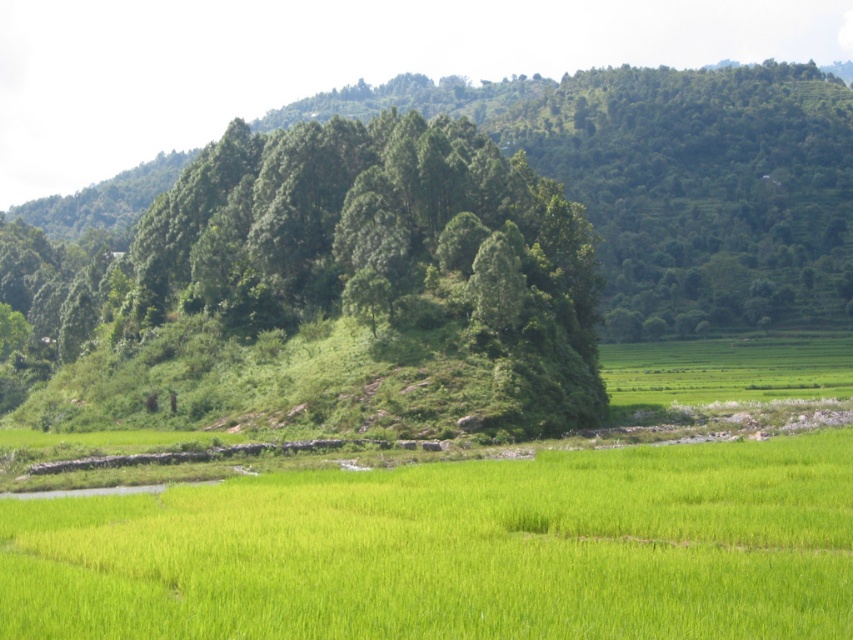
Can you confirm if green leafy tree at center is positioned below green grassy field at center?

Incorrect, green leafy tree at center is not positioned below green grassy field at center.

Does green leafy tree at center have a smaller size compared to green grassy field at center?

Actually, green leafy tree at center might be larger than green grassy field at center.

Locate an element on the screen. This screenshot has height=640, width=853. green leafy tree at center is located at coordinates (460, 252).